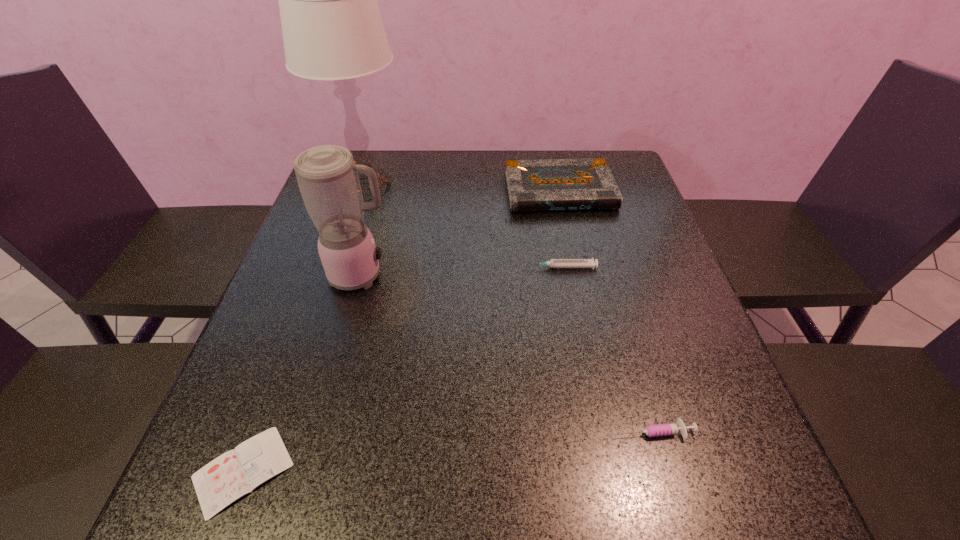
Locate an element on the screen. Image resolution: width=960 pixels, height=540 pixels. the tallest object is located at coordinates (332, 29).

This screenshot has height=540, width=960. In order to click on the second tallest object in this screenshot , I will do `click(327, 176)`.

Identify the location of notebook. This screenshot has width=960, height=540. (559, 184).

Image resolution: width=960 pixels, height=540 pixels. Identify the location of the farther syringe. (553, 263).

Find the location of `the nearer syringe`. the nearer syringe is located at coordinates click(x=678, y=428).

Identify the location of diary. The width and height of the screenshot is (960, 540). (237, 472).

At what (x,y) coordinates should I click in order to perform the action: click on free space located on the front-facing side of the tallest object. Please return your answer as a coordinate pair (x, y). This screenshot has width=960, height=540. Looking at the image, I should click on (534, 189).

The image size is (960, 540). Identify the location of vacant region located on the base of the fifth shortest object near the control knob. (439, 275).

Where is `vacant region located on the left of the notebook`? This screenshot has width=960, height=540. vacant region located on the left of the notebook is located at coordinates (445, 191).

Find the location of a particular element. free space located 0.400m at the needle end of the farther syringe is located at coordinates (353, 267).